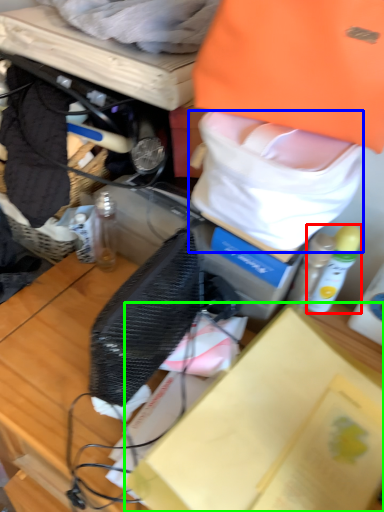
Question: Which object is positioned farthest from bottle (highlighted by a red box)? Select from tote bag (highlighted by a blue box) and box (highlighted by a green box).

Choices:
 (A) tote bag
 (B) box

Answer: (B)